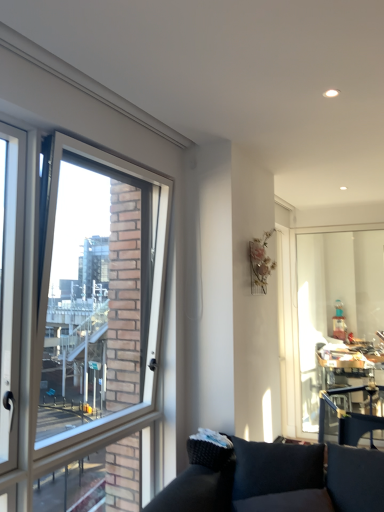
Question: Does transparent glass window screen at right appear on the right side of clear glass window at left?

Choices:
 (A) yes
 (B) no

Answer: (A)

Question: Does transparent glass window screen at right have a lesser height compared to clear glass window at left?

Choices:
 (A) yes
 (B) no

Answer: (A)

Question: Is transparent glass window screen at right not within clear glass window at left?

Choices:
 (A) no
 (B) yes

Answer: (B)

Question: From a real-world perspective, is transparent glass window screen at right positioned under clear glass window at left based on gravity?

Choices:
 (A) no
 (B) yes

Answer: (B)

Question: From the image's perspective, would you say transparent glass window screen at right is positioned over clear glass window at left?

Choices:
 (A) no
 (B) yes

Answer: (A)

Question: Does transparent glass window screen at right come behind clear glass window at left?

Choices:
 (A) no
 (B) yes

Answer: (B)

Question: Can you confirm if clear glass window at left is thinner than transparent glass window screen at right?

Choices:
 (A) no
 (B) yes

Answer: (A)

Question: Is clear glass window at left at the left side of transparent glass window screen at right?

Choices:
 (A) no
 (B) yes

Answer: (B)

Question: From a real-world perspective, is clear glass window at left positioned under transparent glass window screen at right based on gravity?

Choices:
 (A) no
 (B) yes

Answer: (A)

Question: Is transparent glass window screen at right located within clear glass window at left?

Choices:
 (A) yes
 (B) no

Answer: (B)

Question: Is clear glass window at left not within transparent glass window screen at right?

Choices:
 (A) yes
 (B) no

Answer: (A)

Question: Is clear glass window at left turned away from transparent glass window screen at right?

Choices:
 (A) yes
 (B) no

Answer: (B)

Question: Is clear glass window at left to the left or to the right of transparent glass window screen at right in the image?

Choices:
 (A) right
 (B) left

Answer: (B)